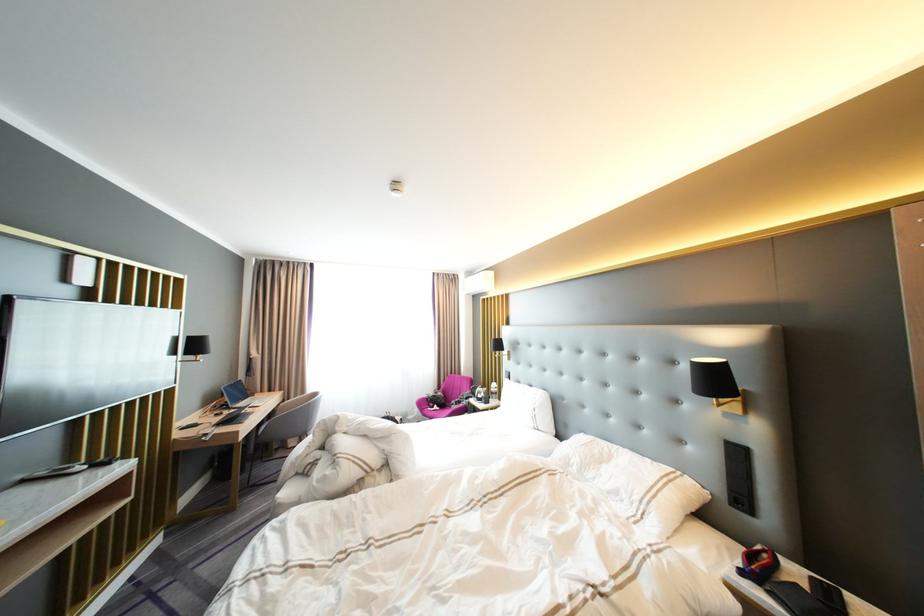
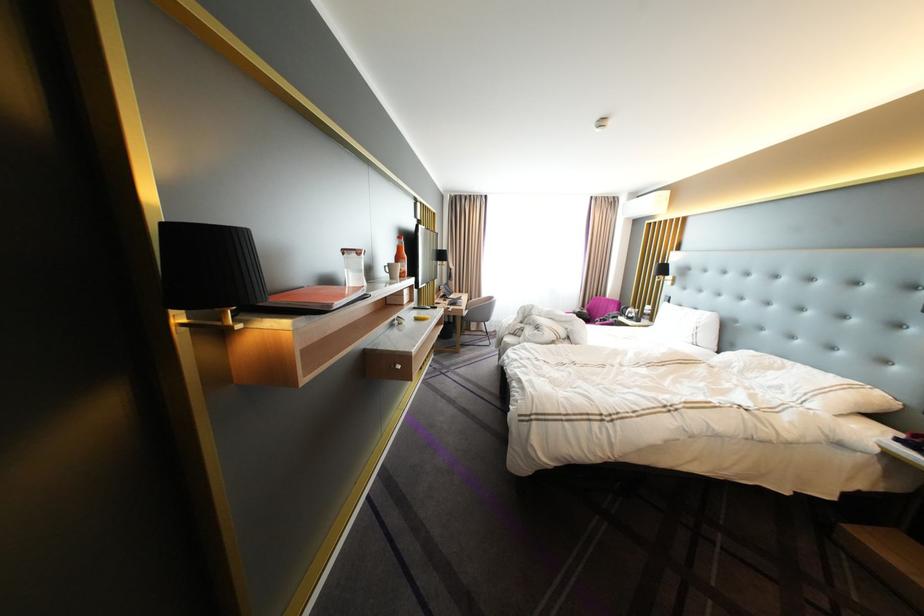
In the second image, find the point that corresponds to [314,392] in the first image.

(492, 296)